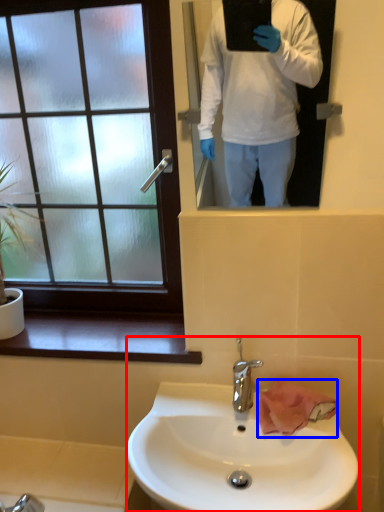
Question: Which point is further to the camera, sink (highlighted by a red box) or hand towel (highlighted by a blue box)?

Choices:
 (A) sink
 (B) hand towel

Answer: (B)